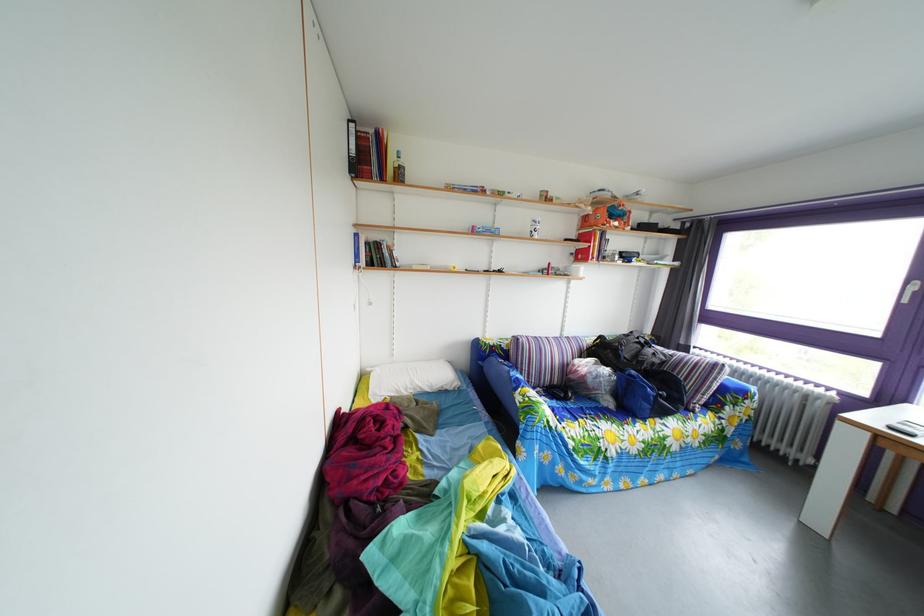
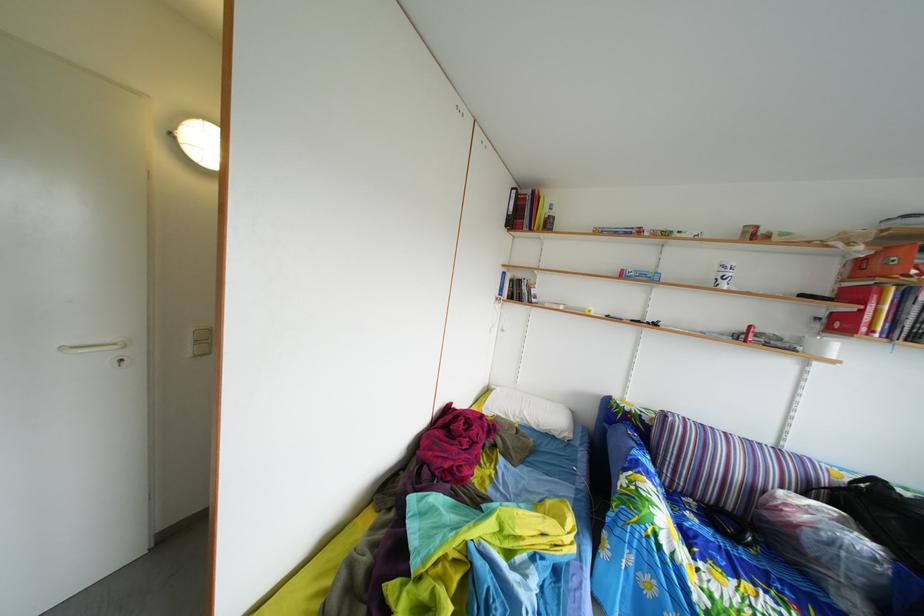
Question: The images are taken continuously from a first-person perspective. In which direction is your viewpoint rotating?

Choices:
 (A) Left
 (B) Right
 (C) Up
 (D) Down

Answer: (A)